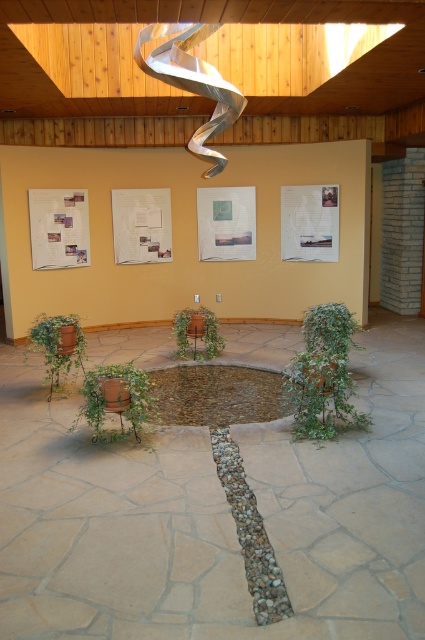
You are standing in the indoor space and want to reach the green leafy plant at center to water it. However, there is a green matte pot at lower left blocking your path. Can you walk directly to the plant without moving the pot?

The green leafy plant at center is in front of the green matte pot at lower left, meaning the pot is behind the plant. Therefore, you can walk directly to the plant without needing to move the pot since the pot isn

You are designing a layout for a small indoor garden and have both the green leafy plant at center and the green matte pot at lower left. Which object takes up more space in the garden?

The green matte pot at lower left takes up more space than the green leafy plant at center.